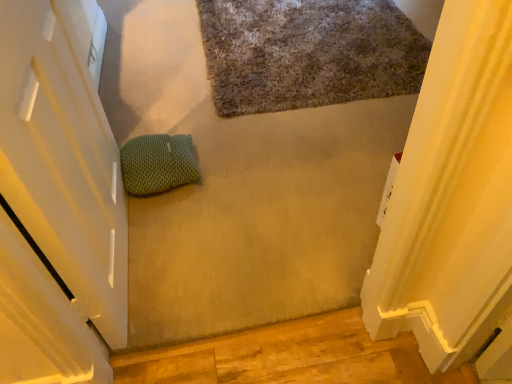
Locate an element on the screen. free space on the front side of textured gray bath mat at upper center is located at coordinates (278, 179).